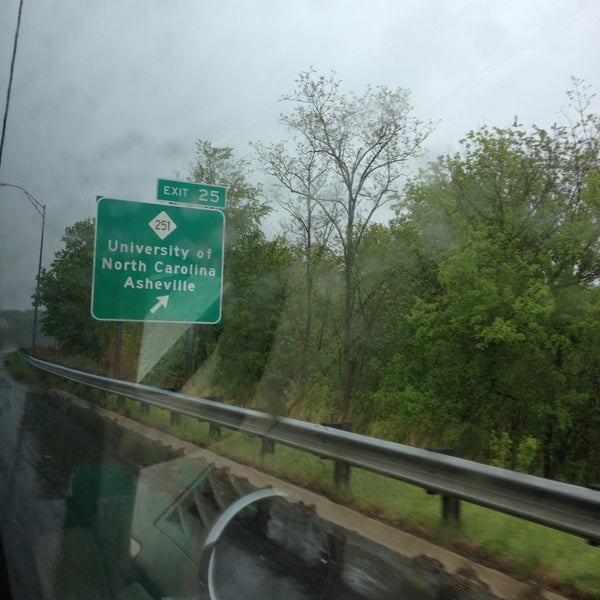
You are a GUI agent. You are given a task and a screenshot of the screen. Output one action in this format:
    pyautogui.click(x=<x>, y=<y>)
    Task: Click on the sign with name of exit
    This screenshot has width=600, height=600.
    Given the screenshot: What is the action you would take?
    pyautogui.click(x=197, y=196)